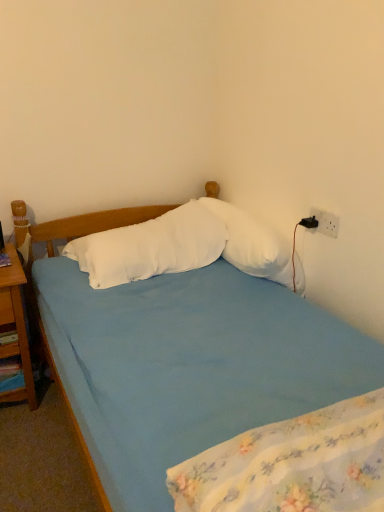
Find the location of a particular element. The image size is (384, 512). black plastic power outlet at upper right is located at coordinates (326, 222).

Measure the distance between black plastic power outlet at upper right and camera.

black plastic power outlet at upper right is 1.57 meters away from camera.

What do you see at coordinates (83, 409) in the screenshot? I see `blue fabric bed at center` at bounding box center [83, 409].

Locate an element on the screen. This screenshot has height=512, width=384. blue fabric bed at center is located at coordinates (83, 409).

In order to click on white soft pillow at center, which ranks as the first pillow in left-to-right order in this screenshot , I will do `click(151, 247)`.

Image resolution: width=384 pixels, height=512 pixels. Find the location of `wooden nightstand at left`. wooden nightstand at left is located at coordinates (16, 327).

Find the location of a particular element. The width and height of the screenshot is (384, 512). blue fabric mattress at lower center is located at coordinates (292, 464).

Is wooden nightstand at left looking in the opposite direction of black plastic power outlet at upper right?

→ No, wooden nightstand at left is not facing the opposite direction of black plastic power outlet at upper right.

Can you confirm if wooden nightstand at left is shorter than black plastic power outlet at upper right?

No, wooden nightstand at left is not shorter than black plastic power outlet at upper right.

Is there a large distance between wooden nightstand at left and black plastic power outlet at upper right?

→ Yes, wooden nightstand at left is far from black plastic power outlet at upper right.

Between blue fabric bed at center and blue fabric mattress at lower center, which one appears on the right side from the viewer's perspective?

Positioned to the right is blue fabric mattress at lower center.

Measure the distance from blue fabric bed at center to blue fabric mattress at lower center.

15.07 inches.

Is blue fabric bed at center not close to blue fabric mattress at lower center?

That's not correct — blue fabric bed at center is a little close to blue fabric mattress at lower center.

What's the angular difference between blue fabric bed at center and blue fabric mattress at lower center's facing directions?

The facing directions of blue fabric bed at center and blue fabric mattress at lower center are 175 degrees apart.

From a real-world perspective, is white soft pillow at center, which ranks as the first pillow in left-to-right order, physically located above or below black plastic power outlet at upper right?

From a real-world perspective, white soft pillow at center, which ranks as the first pillow in left-to-right order, is physically below black plastic power outlet at upper right.

From the image's perspective, is white soft pillow at center, which ranks as the first pillow in left-to-right order, positioned above or below black plastic power outlet at upper right?

white soft pillow at center, which ranks as the first pillow in left-to-right order, is below black plastic power outlet at upper right.

In the scene shown: Which of these two, white soft pillow at center, which ranks as the first pillow in left-to-right order, or black plastic power outlet at upper right, is wider?

With larger width is white soft pillow at center, which ranks as the first pillow in left-to-right order.

Is white soft pillow at center, which ranks as the first pillow in left-to-right order, oriented towards black plastic power outlet at upper right?

No, white soft pillow at center, which ranks as the first pillow in left-to-right order, does not turn towards black plastic power outlet at upper right.

Which object is further away from the camera taking this photo, white soft pillow at center, the first pillow in the right-to-left sequence, or black plastic power outlet at upper right?

black plastic power outlet at upper right.

Considering the positions of objects white soft pillow at center, which is counted as the 2th pillow, starting from the left, and black plastic power outlet at upper right in the image provided, who is more to the right, white soft pillow at center, which is counted as the 2th pillow, starting from the left, or black plastic power outlet at upper right?

black plastic power outlet at upper right is more to the right.

Could you measure the distance between white soft pillow at center, which is counted as the 2th pillow, starting from the left, and black plastic power outlet at upper right?

white soft pillow at center, which is counted as the 2th pillow, starting from the left, is 10.63 inches away from black plastic power outlet at upper right.

Is point (264, 250) positioned before point (26, 347)?

That is True.

From the image's perspective, is white soft pillow at center, which is counted as the 2th pillow, starting from the left, below wooden nightstand at left?

Actually, white soft pillow at center, which is counted as the 2th pillow, starting from the left, appears above wooden nightstand at left in the image.

Starting from the wooden nightstand at left, which pillow is the 2nd one to the right? Please provide its 2D coordinates.

[(253, 244)]

Who is bigger, white soft pillow at center, the first pillow in the right-to-left sequence, or wooden nightstand at left?

Bigger between the two is wooden nightstand at left.

Is wooden nightstand at left situated inside blue fabric bed at center or outside?

wooden nightstand at left exists outside the volume of blue fabric bed at center.

Which object is more forward, wooden nightstand at left or blue fabric bed at center?

blue fabric bed at center.

Would you say wooden nightstand at left is a long distance from blue fabric bed at center?

No, wooden nightstand at left is not far from blue fabric bed at center.

Based on their positions, is wooden nightstand at left located to the left or right of blue fabric bed at center?

wooden nightstand at left is to the left of blue fabric bed at center.

Looking at this image, considering the sizes of white soft pillow at center, which ranks as the first pillow in left-to-right order, and blue fabric mattress at lower center in the image, is white soft pillow at center, which ranks as the first pillow in left-to-right order, bigger or smaller than blue fabric mattress at lower center?

In the image, white soft pillow at center, which ranks as the first pillow in left-to-right order, appears to be larger than blue fabric mattress at lower center.

Which object is closer to the camera taking this photo, white soft pillow at center, which ranks as the first pillow in left-to-right order, or blue fabric mattress at lower center?

blue fabric mattress at lower center is more forward.

Looking at this image, between white soft pillow at center, which ranks as the first pillow in left-to-right order, and blue fabric mattress at lower center, which one has less height?

white soft pillow at center, which ranks as the first pillow in left-to-right order.

How much distance is there between white soft pillow at center, which ranks as the first pillow in left-to-right order, and blue fabric mattress at lower center?

white soft pillow at center, which ranks as the first pillow in left-to-right order, and blue fabric mattress at lower center are 1.04 meters apart.

The height and width of the screenshot is (512, 384). I want to click on power outlet above the wooden nightstand at left (from a real-world perspective), so click(326, 222).

The image size is (384, 512). In order to click on mattress behind the blue fabric bed at center in this screenshot , I will do `click(292, 464)`.

Looking at the image, which one is located further to blue fabric bed at center, blue fabric mattress at lower center or white soft pillow at center, which is counted as the 2th pillow, starting from the left?

blue fabric mattress at lower center lies further to blue fabric bed at center than the other object.

When comparing their distances from black plastic power outlet at upper right, does blue fabric bed at center or wooden nightstand at left seem closer?

blue fabric bed at center lies closer to black plastic power outlet at upper right than the other object.

When comparing their distances from blue fabric mattress at lower center, does black plastic power outlet at upper right or white soft pillow at center, which is counted as the 2th pillow, starting from the left, seem further?

black plastic power outlet at upper right is further to blue fabric mattress at lower center.

Based on their spatial positions, is blue fabric mattress at lower center or blue fabric bed at center further from wooden nightstand at left?

blue fabric mattress at lower center lies further to wooden nightstand at left than the other object.

Looking at the image, which one is located further to white soft pillow at center, which is counted as the 2th pillow, starting from the left, blue fabric bed at center or wooden nightstand at left?

Based on the image, wooden nightstand at left appears to be further to white soft pillow at center, which is counted as the 2th pillow, starting from the left.

When comparing their distances from white soft pillow at center, which is counted as the 2th pillow, starting from the left, does blue fabric mattress at lower center or blue fabric bed at center seem further?

blue fabric mattress at lower center is further to white soft pillow at center, which is counted as the 2th pillow, starting from the left.

Estimate the real-world distances between objects in this image. Which object is closer to black plastic power outlet at upper right, blue fabric bed at center or white soft pillow at center, the first pillow in the right-to-left sequence?

Among the two, white soft pillow at center, the first pillow in the right-to-left sequence, is located nearer to black plastic power outlet at upper right.

Looking at the image, which one is located further to blue fabric mattress at lower center, blue fabric bed at center or black plastic power outlet at upper right?

black plastic power outlet at upper right is further to blue fabric mattress at lower center.

Locate an element on the screen. The height and width of the screenshot is (512, 384). nightstand between blue fabric mattress at lower center and white soft pillow at center, arranged as the 2th pillow when viewed from the right, in the front-back direction is located at coordinates (16, 327).

You are a GUI agent. You are given a task and a screenshot of the screen. Output one action in this format:
    pyautogui.click(x=<x>, y=<y>)
    Task: Click on the bed between wooden nightstand at left and black plastic power outlet at upper right in the horizontal direction
    
    Given the screenshot: What is the action you would take?
    pyautogui.click(x=83, y=409)

Identify the location of mattress situated between wooden nightstand at left and black plastic power outlet at upper right from left to right. The image size is (384, 512). (292, 464).

Where is `mattress located between blue fabric bed at center and wooden nightstand at left in the depth direction`? The height and width of the screenshot is (512, 384). mattress located between blue fabric bed at center and wooden nightstand at left in the depth direction is located at coordinates (292, 464).